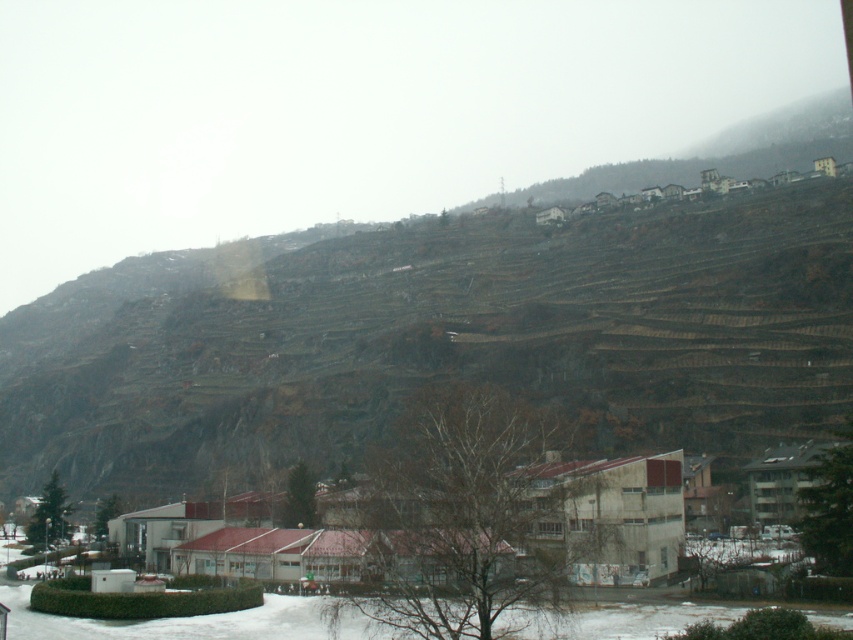
Does white concrete buildings at lower center appear on the left side of brown stone houses at upper right?

Yes, white concrete buildings at lower center is to the left of brown stone houses at upper right.

Between point (643, 541) and point (585, 196), which one is positioned in front?

Point (643, 541) is in front.

In the scene shown: Who is more distant from viewer, (714, 577) or (541, 202)?

Point (541, 202)

Image resolution: width=853 pixels, height=640 pixels. Find the location of `white concrete buildings at lower center`. white concrete buildings at lower center is located at coordinates (614, 522).